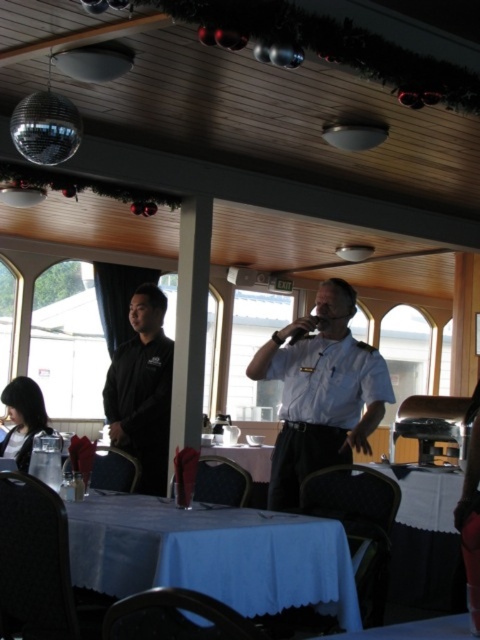
You are a guest at this event and want to find the white uniform at center. From your position facing the scene, which direction should you look relative to the black smooth shirt at left?

The white uniform at center is to the right of the black smooth shirt at left, so you should look to the right of the black smooth shirt at left to find the white uniform at center.

You are a guest at this event and want to grab a drink from the blue fabric table at lower center. However, there is a black smooth shirt at left in your way. Can you reach the table without moving the shirt?

The blue fabric table at lower center is closer to the viewer than the black smooth shirt at left, so you can reach the table without needing to move the shirt since it is nearer to you than the shirt.

You are a server in a boat dining area and need to deliver a drink to the white uniform at center. The blue fabric table at lower center is in the way. Can you walk around it without getting too close? The minimum safe distance for passing is 12 inches.

The blue fabric table at lower center is 33.23 inches away from the white uniform at center. Since the minimum safe distance is 12 inches, you can walk around it safely as the distance is more than enough.